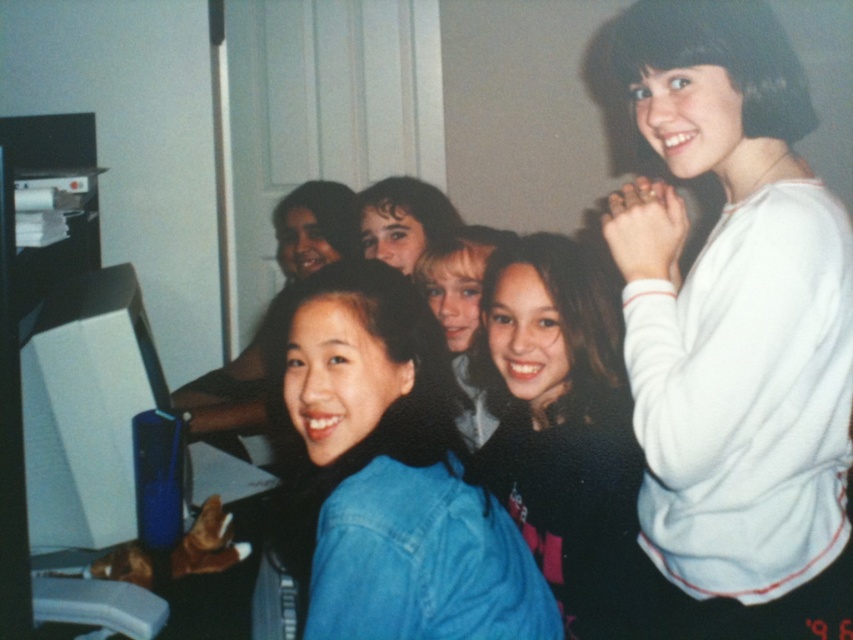
Question: Is denim jacket at center smaller than dark brown hair at center?

Choices:
 (A) no
 (B) yes

Answer: (A)

Question: Does denim jacket at center have a lesser width compared to black matte shirt at center?

Choices:
 (A) yes
 (B) no

Answer: (B)

Question: Which of these objects is positioned closest to the denim jacket at center?

Choices:
 (A) dark brown hair at center
 (B) black matte shirt at center

Answer: (B)

Question: Which object is the farthest from the white fleece sweater at upper right?

Choices:
 (A) dark brown hair at center
 (B) black matte shirt at center
 (C) denim jacket at center

Answer: (A)

Question: Which of these objects is positioned farthest from the dark brown hair at center?

Choices:
 (A) white fleece sweater at upper right
 (B) black matte shirt at center
 (C) denim jacket at center

Answer: (A)

Question: Can you confirm if white fleece sweater at upper right is smaller than denim jacket at center?

Choices:
 (A) no
 (B) yes

Answer: (A)